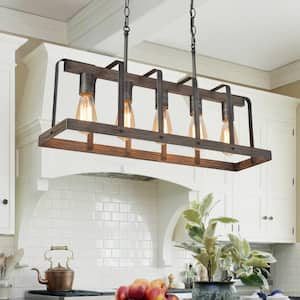
Locate an element on the screen. leftmost cabinet is located at coordinates (8, 218).